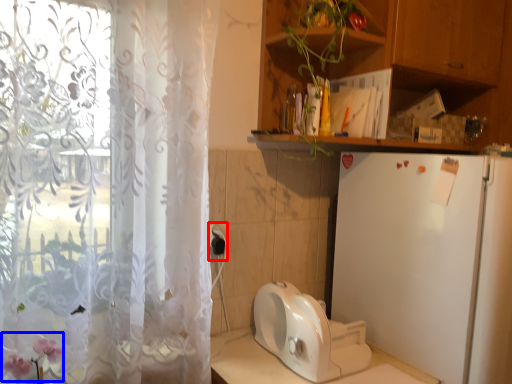
Question: Which object is closer to the camera taking this photo, electric outlet (highlighted by a red box) or flower (highlighted by a blue box)?

Choices:
 (A) electric outlet
 (B) flower

Answer: (B)